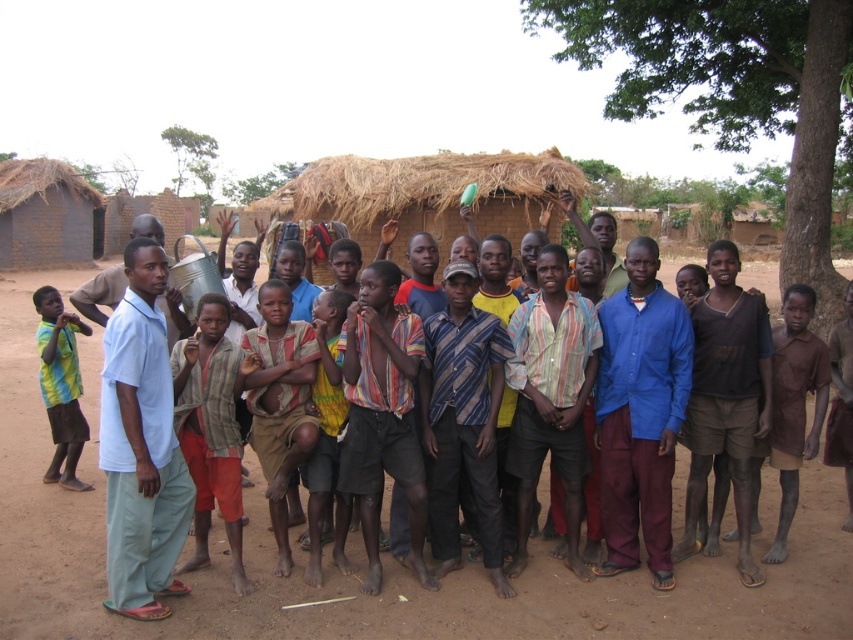
You are a photographer trying to capture a photo of the light blue cotton shirt at center without the green leafy tree at right blocking the view. Based on their heights, can you position yourself in a way that the tree won

The green leafy tree at right is much taller than the light blue cotton shirt at center, so positioning yourself at a lower angle or moving closer to the shirt might help avoid the tree obstructing the view.